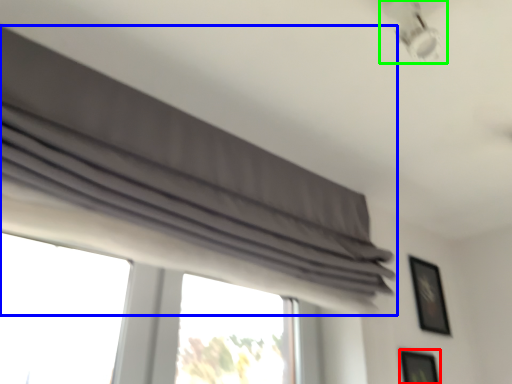
Question: Based on their relative distances, which object is farther from picture frame (highlighted by a red box)? Choose from curtain (highlighted by a blue box) and lamp (highlighted by a green box).

Choices:
 (A) curtain
 (B) lamp

Answer: (B)